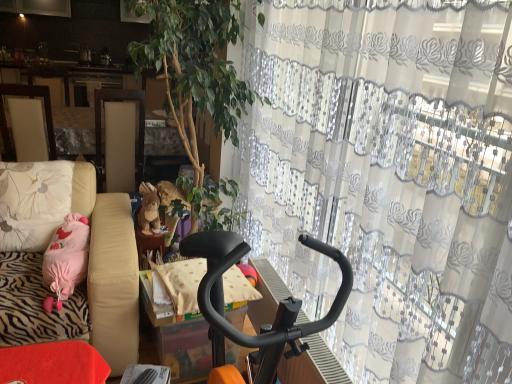
Question: Considering the relative sizes of pink fabric pillow at left and black plastic exercise bike at center in the image provided, is pink fabric pillow at left shorter than black plastic exercise bike at center?

Choices:
 (A) no
 (B) yes

Answer: (B)

Question: From a real-world perspective, is pink fabric pillow at left on black plastic exercise bike at center?

Choices:
 (A) no
 (B) yes

Answer: (A)

Question: Does pink fabric pillow at left lie in front of black plastic exercise bike at center?

Choices:
 (A) no
 (B) yes

Answer: (A)

Question: Can you confirm if pink fabric pillow at left is bigger than black plastic exercise bike at center?

Choices:
 (A) yes
 (B) no

Answer: (A)

Question: Does pink fabric pillow at left have a greater width compared to black plastic exercise bike at center?

Choices:
 (A) no
 (B) yes

Answer: (B)

Question: Is pink fabric pillow at left looking in the opposite direction of black plastic exercise bike at center?

Choices:
 (A) no
 (B) yes

Answer: (A)

Question: Does brown plush rabbit at center turn towards pink fabric pillow at left?

Choices:
 (A) yes
 (B) no

Answer: (A)

Question: Is brown plush rabbit at center far away from pink fabric pillow at left?

Choices:
 (A) yes
 (B) no

Answer: (B)

Question: Is brown plush rabbit at center to the left of pink fabric pillow at left from the viewer's perspective?

Choices:
 (A) no
 (B) yes

Answer: (A)

Question: Is brown plush rabbit at center looking in the opposite direction of pink fabric pillow at left?

Choices:
 (A) yes
 (B) no

Answer: (B)

Question: From the image's perspective, is brown plush rabbit at center above pink fabric pillow at left?

Choices:
 (A) yes
 (B) no

Answer: (A)

Question: Considering the relative positions of brown plush rabbit at center and pink fabric pillow at left in the image provided, is brown plush rabbit at center to the right of pink fabric pillow at left from the viewer's perspective?

Choices:
 (A) no
 (B) yes

Answer: (B)

Question: From the image's perspective, is black textured cushion at center beneath black plastic exercise bike at center?

Choices:
 (A) yes
 (B) no

Answer: (B)